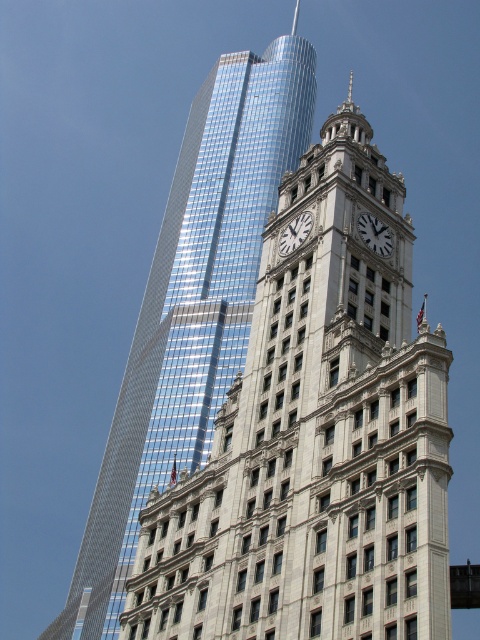
You are an architect analyzing the layout of the cityscape. Given the coordinates provided, where exactly is the reflective glass skyscraper at upper left positioned in the image?

The reflective glass skyscraper at upper left is positioned at the coordinates point (315, 440).

You are standing at the center of the image and want to take a photo of the shiny glass skyscraper at upper left. Which direction should you point your camera to capture it?

The shiny glass skyscraper at upper left is located at point [192,305], which is to the upper left from your current position at the center. Point your camera towards the upper left direction to capture it.

You are an architect analyzing the layout of the buildings in the image. Which of the two objects, the reflective glass skyscraper at upper left or the white marble clock at upper center, is positioned to the east if the sun is setting in the west?

The reflective glass skyscraper at upper left is to the right of the white marble clock at upper center. Since the sun is setting in the west, the side facing east would receive more sunlight. The skyscraper being to the right suggests it is east of the clock, so the reflective glass skyscraper at upper left is positioned to the east.